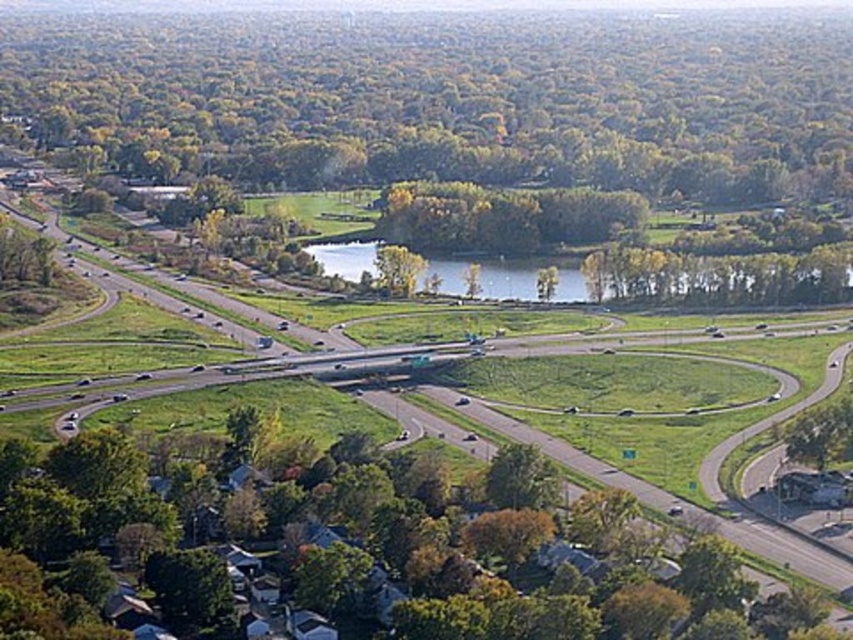
Which is in front, point (708, 593) or point (321, 257)?

Positioned in front is point (708, 593).

This screenshot has height=640, width=853. Describe the element at coordinates (519, 564) in the screenshot. I see `green leafy tree at lower center` at that location.

Who is more distant from viewer, [88,440] or [431,260]?

The point [431,260] is behind.

Identify the location of green leafy tree at lower center. Image resolution: width=853 pixels, height=640 pixels. (519, 564).